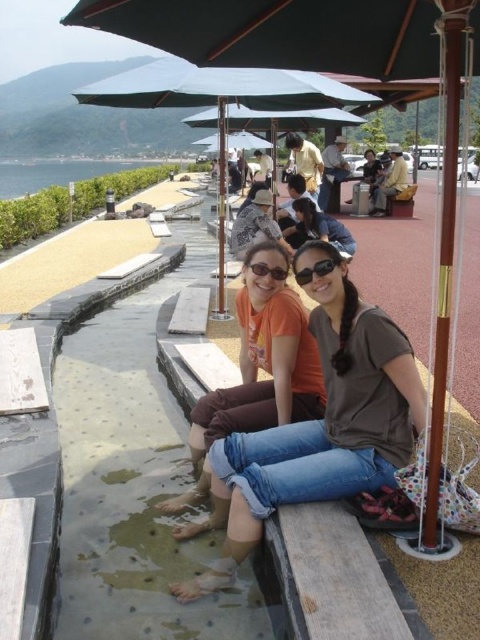
You are a photographer trying to capture the scene with the two people sitting on the bench. You notice both individuals are wearing sunglasses. Which of the sunglasses, the black matte sunglasses at center or the matte black sunglasses at center, is positioned lower on their faces?

The black matte sunglasses at center is located below matte black sunglasses at center, so the black matte sunglasses at center is positioned lower on their faces.